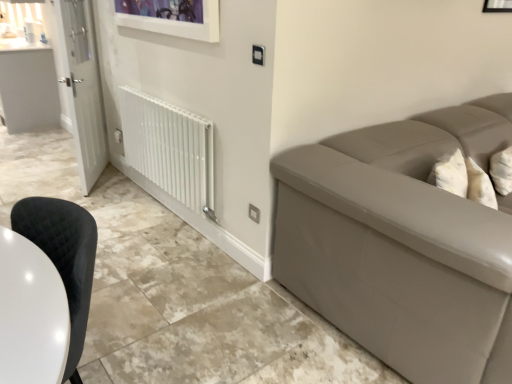
What are the coordinates of `free spot in front of white glossy door at left` in the screenshot? It's located at tap(95, 198).